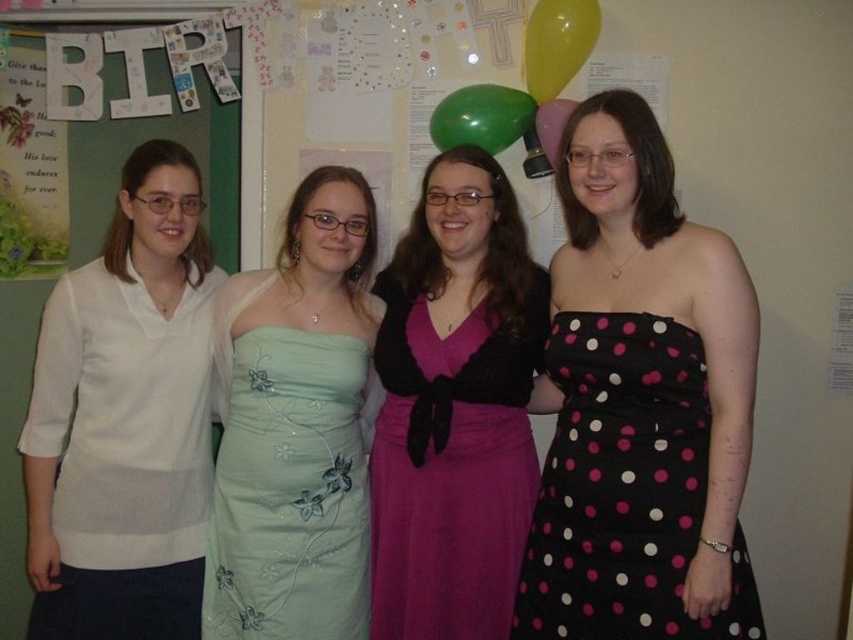
You are organizing a photo shoot and need to ensure that the green rubber balloon at upper center is visible above the purple satin dress at center. Based on the scene description, will the balloon be visible over the dress?

The purple satin dress at center is much taller than the green rubber balloon at upper center, so the balloon will not be visible above the dress.

In the scene shown: You are organizing a clothing donation drive and need to determine which clothing items can fit into a standard donation bin that has a maximum width capacity of 40 cm. You have two items to assess from the image provided. The first item is the white cotton shirt at left, and the second is the purple satin dress at center. Based on their widths, which item is more likely to exceed the bin width limit?

The white cotton shirt at left has a larger width than the purple satin dress at center, so it is more likely to exceed the bin width limit of 40 cm.

You are standing in the classroom and need to reach both the point at coordinates (x=252, y=561) and the point at coordinates (x=445, y=145). Which point should you approach first to minimize the total distance walked?

You should approach point (x=252, y=561) first since it is closer to you than point (x=445, y=145), so reaching it first minimizes the total distance walked.